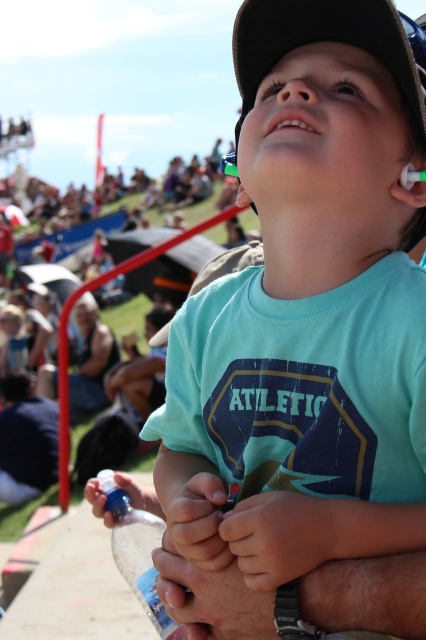
You are a photographer trying to capture a candid shot of the child in the scene. You notice the dark blue shirt at lower left and the bright white teeth at center. Which object should you focus on first if you want to ensure both are in the frame?

You should focus on the bright white teeth at center first because the dark blue shirt at lower left is located below it, ensuring both will be in the frame when centered on the teeth.